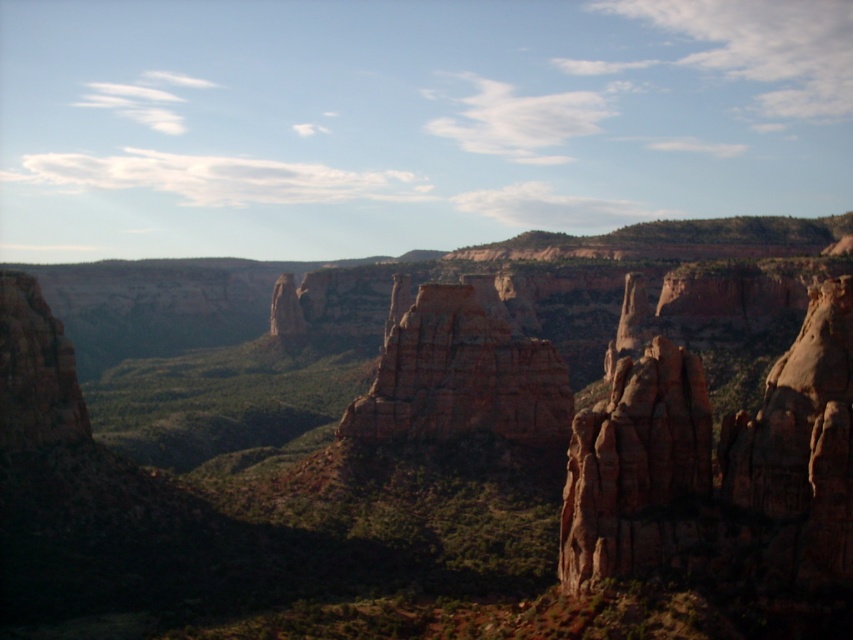
You are standing in the valley with green vegetation and want to take a photo of both the rustic sandstone rock formation at right and the rustic sandstone rock formation at center. Which rock formation should you position yourself closer to in order to capture both in the same frame?

You should position yourself closer to the rustic sandstone rock formation at right because it is located below the rustic sandstone rock formation at center, allowing both to be included in the frame when positioned closer to the lower one.

You are standing in the valley with green vegetation and want to reach the rustic sandstone rock formation at center. Which direction should you head towards from the rustic rock formation at center?

The rustic rock formation at center is to the left of rustic sandstone rock formation at center, so to reach the rustic sandstone rock formation at center from the rustic rock formation at center, you should head towards the right.

You are a hiker standing at the edge of the valley looking towards the rustic sandstone rock formation at right and the rustic sandstone rock formation at center. Which rock formation is closer to you?

The rustic sandstone rock formation at right is closer to you because it is positioned in front of the rustic sandstone rock formation at center.